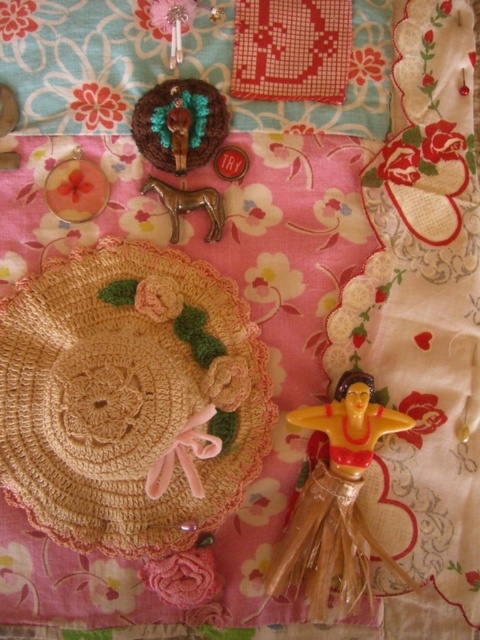
Between yellow plastic barbie at lower right and metallic gold horse at center, which one has less height?

Standing shorter between the two is metallic gold horse at center.

Between point (288, 525) and point (162, 189), which one is positioned behind?

The point (162, 189) is behind.

The height and width of the screenshot is (640, 480). In order to click on yellow plastic barbie at lower right in this screenshot , I will do `click(335, 504)`.

Does point (176, 168) come in front of point (216, 230)?

Yes, point (176, 168) is closer to viewer.

The width and height of the screenshot is (480, 640). What do you see at coordinates (180, 124) in the screenshot? I see `turquoise felt brooch at upper center` at bounding box center [180, 124].

This screenshot has width=480, height=640. In order to click on turquoise felt brooch at upper center in this screenshot , I will do `click(180, 124)`.

Identify the location of turquoise felt brooch at upper center. (180, 124).

Who is taller, yellow plastic barbie at lower right or turquoise felt brooch at upper center?

With more height is yellow plastic barbie at lower right.

Consider the image. Is yellow plastic barbie at lower right behind turquoise felt brooch at upper center?

No, yellow plastic barbie at lower right is in front of turquoise felt brooch at upper center.

Which is behind, point (344, 561) or point (223, 124)?

The point (223, 124) is more distant.

Locate an element on the screen. Image resolution: width=480 pixels, height=640 pixels. yellow plastic barbie at lower right is located at coordinates tap(335, 504).